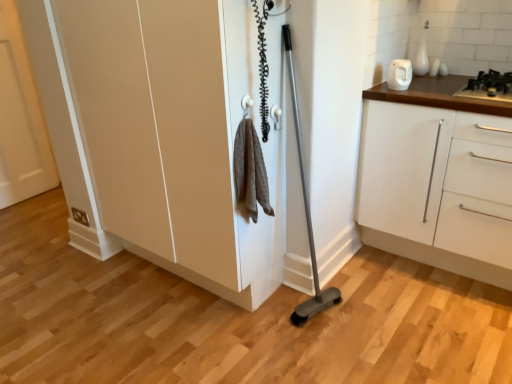
The height and width of the screenshot is (384, 512). What do you see at coordinates (437, 188) in the screenshot?
I see `white matte cabinet at right` at bounding box center [437, 188].

The width and height of the screenshot is (512, 384). What do you see at coordinates (173, 137) in the screenshot?
I see `matte white cupboard at center` at bounding box center [173, 137].

Describe the element at coordinates (399, 74) in the screenshot. The height and width of the screenshot is (384, 512). I see `white glossy kettle at upper right` at that location.

Based on the photo, what is the approximate height of white glossy kettle at upper right?

The height of white glossy kettle at upper right is 5.45 inches.

Locate an element on the screen. black metallic gas stove at upper right is located at coordinates (488, 87).

Would you say white matte cabinet at right is part of white matte door at left's contents?

That's incorrect, white matte cabinet at right is not inside white matte door at left.

Measure the distance from white matte door at left to white matte cabinet at right.

2.51 meters.

In the scene shown: Is white matte door at left bigger or smaller than white matte cabinet at right?

Considering their sizes, white matte door at left takes up less space than white matte cabinet at right.

Is point (2, 12) positioned before point (398, 162)?

No, (2, 12) is further to viewer.

From the image's perspective, is black metallic gas stove at upper right located above white matte cabinet at right?

Yes, from the image's perspective, black metallic gas stove at upper right is on top of white matte cabinet at right.

Based on their positions, is black metallic gas stove at upper right located to the left or right of white matte cabinet at right?

Clearly, black metallic gas stove at upper right is on the right of white matte cabinet at right in the image.

Is black metallic gas stove at upper right positioned with its back to white matte cabinet at right?

That's not correct — black metallic gas stove at upper right is not looking away from white matte cabinet at right.

In terms of width, does black metallic gas stove at upper right look wider or thinner when compared to white matte cabinet at right?

Clearly, black metallic gas stove at upper right has less width compared to white matte cabinet at right.

From the picture: From a real-world perspective, is white matte cabinet at right over white glossy kettle at upper right?

No, from a real-world perspective, white matte cabinet at right is not on top of white glossy kettle at upper right.

Between white matte cabinet at right and white glossy kettle at upper right, which one has larger size?

white matte cabinet at right.

How many degrees apart are the facing directions of white matte cabinet at right and white glossy kettle at upper right?

The angle between the facing direction of white matte cabinet at right and the facing direction of white glossy kettle at upper right is 1.96 degrees.

Identify the location of cabinetry below the white glossy kettle at upper right (from the image's perspective). The image size is (512, 384). (437, 188).

From the image's perspective, which is above, white glossy kettle at upper right or white matte cabinet at right?

white glossy kettle at upper right.

Can you confirm if white glossy kettle at upper right is positioned to the left of white matte cabinet at right?

Correct, you'll find white glossy kettle at upper right to the left of white matte cabinet at right.

Is white glossy kettle at upper right facing towards white matte cabinet at right?

No, white glossy kettle at upper right is not aimed at white matte cabinet at right.

Would you say matte white cupboard at center is outside black metallic gas stove at upper right?

Yes, matte white cupboard at center is not within black metallic gas stove at upper right.

Are matte white cupboard at center and black metallic gas stove at upper right located far from each other?

Yes, matte white cupboard at center is far from black metallic gas stove at upper right.

Could you tell me if matte white cupboard at center is turned towards black metallic gas stove at upper right?

No, matte white cupboard at center is not facing towards black metallic gas stove at upper right.

Which point is more forward, (98, 23) or (496, 87)?

The point (98, 23) is closer to the camera.

From the image's perspective, relative to black metallic gas stove at upper right, is white glossy kettle at upper right above or below?

Clearly, from the image's perspective, white glossy kettle at upper right is above black metallic gas stove at upper right.

Between point (400, 84) and point (509, 91), which one is positioned behind?

Positioned behind is point (400, 84).

Looking at this image, considering the relative sizes of white glossy kettle at upper right and black metallic gas stove at upper right in the image provided, is white glossy kettle at upper right thinner than black metallic gas stove at upper right?

Indeed, white glossy kettle at upper right has a lesser width compared to black metallic gas stove at upper right.

Is white glossy kettle at upper right placed right next to black metallic gas stove at upper right?

No.

Is matte white cupboard at center aimed at white matte cabinet at right?

No, matte white cupboard at center is not aimed at white matte cabinet at right.

How distant is matte white cupboard at center from white matte cabinet at right?

matte white cupboard at center and white matte cabinet at right are 27.03 inches apart from each other.

Locate an element on the screen. cabinetry that is behind the matte white cupboard at center is located at coordinates (437, 188).

In the image, there is a white matte door at left. Where is `cabinetry below it (from the image's perspective)`? This screenshot has width=512, height=384. cabinetry below it (from the image's perspective) is located at coordinates (437, 188).

This screenshot has height=384, width=512. In order to click on cabinetry on the left of black metallic gas stove at upper right in this screenshot , I will do `click(437, 188)`.

Looking at the image, which one is located further to white matte door at left, white matte cabinet at right or white glossy kettle at upper right?

Among the two, white matte cabinet at right is located further to white matte door at left.

Based on their spatial positions, is white glossy kettle at upper right or matte white cupboard at center closer to white matte door at left?

Based on the image, matte white cupboard at center appears to be nearer to white matte door at left.

Looking at the image, which one is located closer to matte white cupboard at center, white glossy kettle at upper right or black metallic gas stove at upper right?

white glossy kettle at upper right lies closer to matte white cupboard at center than the other object.

Based on their spatial positions, is matte white cupboard at center or white matte cabinet at right further from white glossy kettle at upper right?

matte white cupboard at center.

Estimate the real-world distances between objects in this image. Which object is further from white matte cabinet at right, white matte door at left or matte white cupboard at center?

white matte door at left.

Which object lies nearer to the anchor point white glossy kettle at upper right, black metallic gas stove at upper right or white matte cabinet at right?

black metallic gas stove at upper right.

Based on their spatial positions, is white matte cabinet at right or black metallic gas stove at upper right closer to white matte door at left?

white matte cabinet at right is closer to white matte door at left.

Estimate the real-world distances between objects in this image. Which object is further from matte white cupboard at center, black metallic gas stove at upper right or white glossy kettle at upper right?

Based on the image, black metallic gas stove at upper right appears to be further to matte white cupboard at center.

Identify the location of cupboard between white matte door at left and white matte cabinet at right in the horizontal direction. (173, 137).

Where is `appliance between matte white cupboard at center and white matte cabinet at right from left to right`? This screenshot has width=512, height=384. appliance between matte white cupboard at center and white matte cabinet at right from left to right is located at coordinates (399, 74).

At what (x,y) coordinates should I click in order to perform the action: click on appliance located between white matte door at left and white matte cabinet at right in the left-right direction. Please return your answer as a coordinate pair (x, y). Looking at the image, I should click on (399, 74).

Image resolution: width=512 pixels, height=384 pixels. I want to click on cabinetry situated between white matte door at left and black metallic gas stove at upper right from left to right, so click(437, 188).